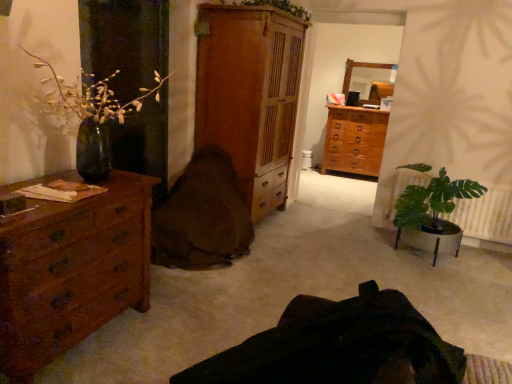
Question: Is brown fabric swivel chair at center, which appears as the second swivel chair when viewed from the front, to the right of green glossy vase at left, marked as the 1th houseplant in a left-to-right arrangement, from the viewer's perspective?

Choices:
 (A) no
 (B) yes

Answer: (B)

Question: Is brown fabric swivel chair at center, which appears as the second swivel chair when viewed from the front, in front of green glossy vase at left, the first houseplant in the front-to-back sequence?

Choices:
 (A) no
 (B) yes

Answer: (A)

Question: Is brown fabric swivel chair at center, placed as the first swivel chair when sorted from back to front, outside green glossy vase at left, placed as the 2th houseplant when sorted from right to left?

Choices:
 (A) yes
 (B) no

Answer: (A)

Question: Is brown fabric swivel chair at center, which appears as the second swivel chair when viewed from the front, next to green glossy vase at left, marked as the 1th houseplant in a left-to-right arrangement?

Choices:
 (A) no
 (B) yes

Answer: (A)

Question: Is green glossy vase at left, placed as the 2th houseplant when sorted from right to left, inside brown fabric swivel chair at center, which appears as the second swivel chair when viewed from the front?

Choices:
 (A) yes
 (B) no

Answer: (B)

Question: Based on their sizes in the image, would you say brown wooden chest of drawers at center, which is the third chest of drawers from front to back, is bigger or smaller than green leafy plant at lower right, placed as the second houseplant when sorted from left to right?

Choices:
 (A) big
 (B) small

Answer: (A)

Question: From the image's perspective, is brown wooden chest of drawers at center, arranged as the 1th chest of drawers when viewed from the right, above or below green leafy plant at lower right, placed as the second houseplant when sorted from front to back?

Choices:
 (A) above
 (B) below

Answer: (A)

Question: In terms of width, does brown wooden chest of drawers at center, positioned as the 3th chest of drawers in left-to-right order, look wider or thinner when compared to green leafy plant at lower right, marked as the first houseplant in a back-to-front arrangement?

Choices:
 (A) thin
 (B) wide

Answer: (B)

Question: Which is correct: brown wooden chest of drawers at center, arranged as the 1th chest of drawers when viewed from the right, is inside green leafy plant at lower right, which is counted as the 1th houseplant, starting from the right, or outside of it?

Choices:
 (A) inside
 (B) outside

Answer: (B)

Question: Considering the positions of brown wooden chest of drawers at center, which appears as the 1th chest of drawers when viewed from the back, and dark brown leather swivel chair at center, the first swivel chair when ordered from front to back, in the image, is brown wooden chest of drawers at center, which appears as the 1th chest of drawers when viewed from the back, bigger or smaller than dark brown leather swivel chair at center, the first swivel chair when ordered from front to back,?

Choices:
 (A) big
 (B) small

Answer: (A)

Question: Considering the relative positions of brown wooden chest of drawers at center, which appears as the 1th chest of drawers when viewed from the back, and dark brown leather swivel chair at center, placed as the 2th swivel chair when sorted from back to front, in the image provided, is brown wooden chest of drawers at center, which appears as the 1th chest of drawers when viewed from the back, to the left or to the right of dark brown leather swivel chair at center, placed as the 2th swivel chair when sorted from back to front,?

Choices:
 (A) left
 (B) right

Answer: (B)

Question: Looking at their shapes, would you say brown wooden chest of drawers at center, arranged as the 1th chest of drawers when viewed from the right, is wider or thinner than dark brown leather swivel chair at center, the first swivel chair when ordered from front to back?

Choices:
 (A) wide
 (B) thin

Answer: (B)

Question: Is brown wooden chest of drawers at center, arranged as the 1th chest of drawers when viewed from the right, inside or outside of dark brown leather swivel chair at center, placed as the 2th swivel chair when sorted from back to front?

Choices:
 (A) outside
 (B) inside

Answer: (A)

Question: From a real-world perspective, is green glossy vase at left, placed as the 2th houseplant when sorted from right to left, above or below brown wood chest of drawers at left, the 3th chest of drawers in the back-to-front sequence?

Choices:
 (A) below
 (B) above

Answer: (B)

Question: Is green glossy vase at left, the first houseplant in the front-to-back sequence, situated inside brown wood chest of drawers at left, which is the first chest of drawers in front-to-back order, or outside?

Choices:
 (A) inside
 (B) outside

Answer: (B)